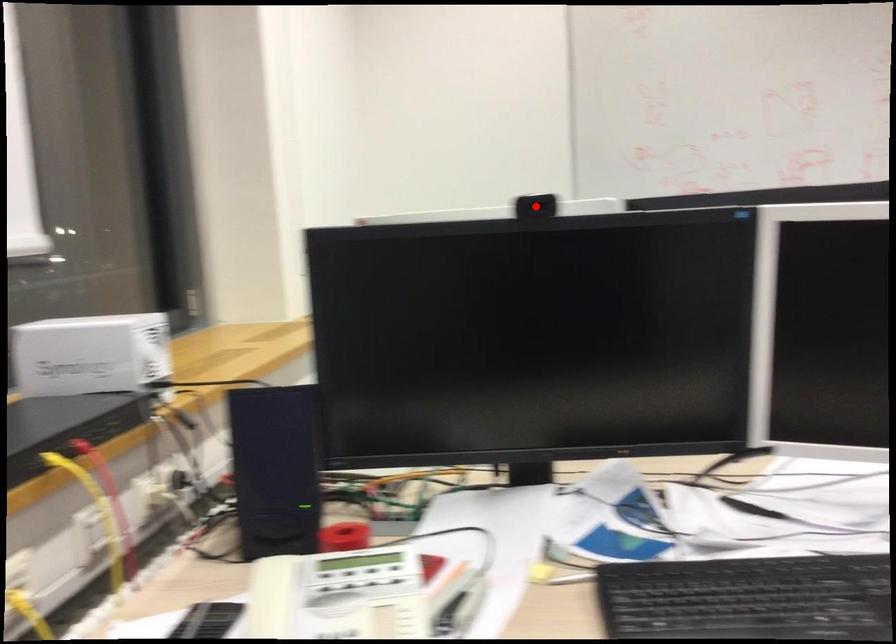
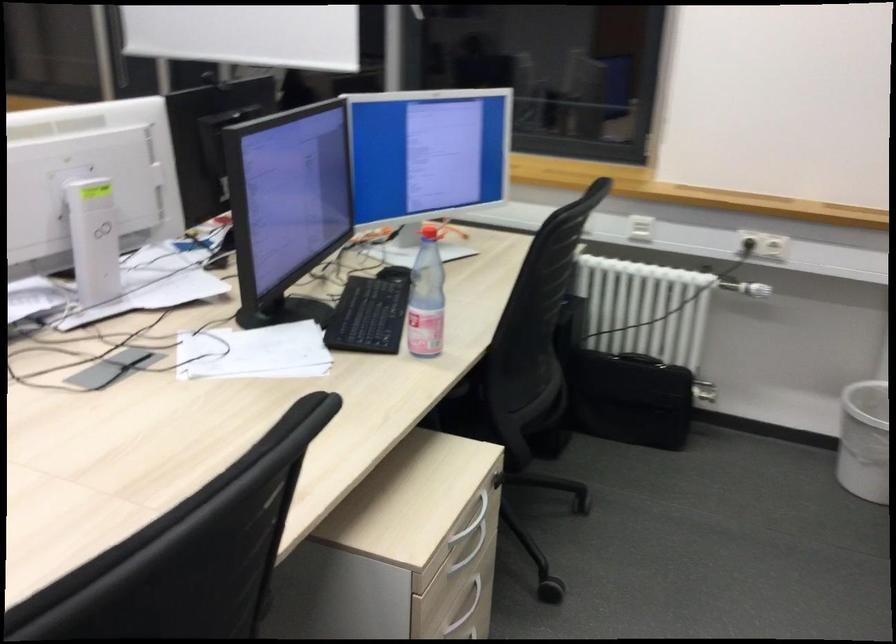
Question: I am providing you with two images of the same scene from different viewpoints. A red point is marked on the first image. Can you still see the location of the red point in image 2?

Choices:
 (A) Yes
 (B) No

Answer: (B)